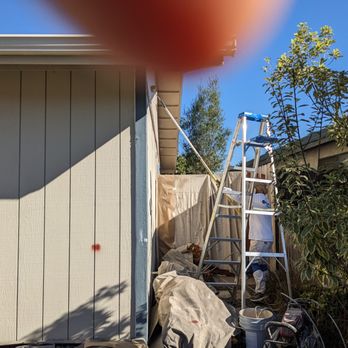
Locate an element on the screen. This screenshot has height=348, width=348. light gray wall is located at coordinates (153, 156).